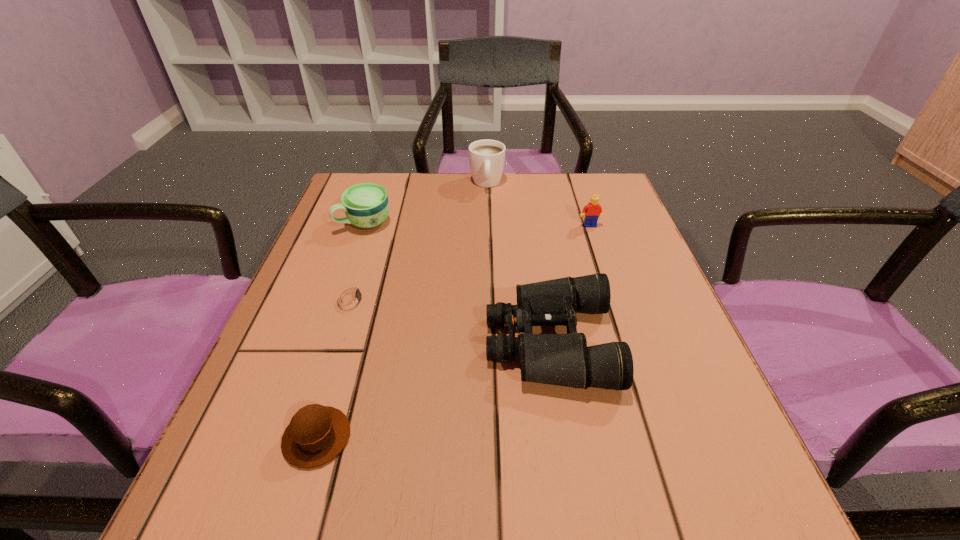
Locate an element on the screen. The width and height of the screenshot is (960, 540). watch at the left edge is located at coordinates (351, 299).

Image resolution: width=960 pixels, height=540 pixels. Find the location of `Lego that is at the right edge`. Lego that is at the right edge is located at coordinates (593, 210).

Locate an element on the screen. The width and height of the screenshot is (960, 540). binoculars present at the right edge is located at coordinates (557, 359).

Image resolution: width=960 pixels, height=540 pixels. I want to click on object at the far left corner, so click(x=366, y=205).

Where is `free space at the far edge of the desktop`? free space at the far edge of the desktop is located at coordinates (449, 219).

In the image, there is a desktop. Where is `vacant space at the left edge`? This screenshot has height=540, width=960. vacant space at the left edge is located at coordinates (379, 247).

You are a GUI agent. You are given a task and a screenshot of the screen. Output one action in this format:
    pyautogui.click(x=<x>, y=<y>)
    Task: Click on the free space at the right edge of the desktop
    
    Given the screenshot: What is the action you would take?
    pyautogui.click(x=698, y=436)

Where is `vacant region at the far left corner of the desktop`? This screenshot has width=960, height=540. vacant region at the far left corner of the desktop is located at coordinates (386, 184).

You are a GUI agent. You are given a task and a screenshot of the screen. Output one action in this format:
    pyautogui.click(x=<x>, y=<y>)
    Task: Click on the free region at the far right corner
    Image resolution: width=960 pixels, height=540 pixels.
    Given the screenshot: What is the action you would take?
    pyautogui.click(x=573, y=174)

Find the location of a particular element. Image resolution: width=960 pixels, height=540 pixels. free space between the cup and the cappuccino is located at coordinates (425, 203).